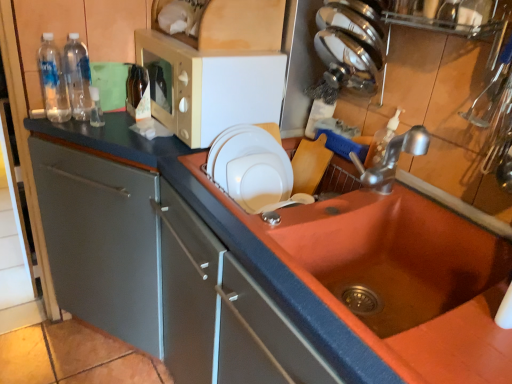
Question: Which direction should I rotate to face white glossy plate at upper center, which appears as the 1th appliance when ordered from the bottom, — up or down?

Choices:
 (A) up
 (B) down

Answer: (A)

Question: From a real-world perspective, is brown glass bottle at upper left, which is the third bottle from left to right, under clear plastic bottles at left, placed as the first bottle when sorted from left to right?

Choices:
 (A) no
 (B) yes

Answer: (B)

Question: Can you confirm if brown glass bottle at upper left, acting as the 1th bottle starting from the right, is thinner than clear plastic bottles at left, placed as the first bottle when sorted from left to right?

Choices:
 (A) yes
 (B) no

Answer: (A)

Question: Is clear plastic bottles at left, placed as the first bottle when sorted from left to right, a part of brown glass bottle at upper left, which is the third bottle from left to right?

Choices:
 (A) yes
 (B) no

Answer: (B)

Question: Is clear plastic bottles at left, placed as the first bottle when sorted from left to right, at the back of brown glass bottle at upper left, which is the third bottle from left to right?

Choices:
 (A) no
 (B) yes

Answer: (A)

Question: Can you confirm if brown glass bottle at upper left, which is the third bottle from left to right, is smaller than clear plastic bottles at left, the third bottle viewed from the right?

Choices:
 (A) no
 (B) yes

Answer: (B)

Question: Considering the relative positions of brown glass bottle at upper left, acting as the 1th bottle starting from the right, and clear plastic bottles at left, placed as the first bottle when sorted from left to right, in the image provided, is brown glass bottle at upper left, acting as the 1th bottle starting from the right, to the right of clear plastic bottles at left, placed as the first bottle when sorted from left to right, from the viewer's perspective?

Choices:
 (A) yes
 (B) no

Answer: (A)

Question: Is matte orange sink at center placed right next to clear plastic bottles at left, the third bottle viewed from the right?

Choices:
 (A) no
 (B) yes

Answer: (A)

Question: Is matte orange sink at center not within clear plastic bottles at left, the third bottle viewed from the right?

Choices:
 (A) yes
 (B) no

Answer: (A)

Question: Considering the relative sizes of matte orange sink at center and clear plastic bottles at left, placed as the first bottle when sorted from left to right, in the image provided, is matte orange sink at center wider than clear plastic bottles at left, placed as the first bottle when sorted from left to right,?

Choices:
 (A) no
 (B) yes

Answer: (B)

Question: Considering the relative sizes of matte orange sink at center and clear plastic bottles at left, the third bottle viewed from the right, in the image provided, is matte orange sink at center taller than clear plastic bottles at left, the third bottle viewed from the right,?

Choices:
 (A) no
 (B) yes

Answer: (A)

Question: From the image's perspective, is matte orange sink at center located beneath clear plastic bottles at left, the third bottle viewed from the right?

Choices:
 (A) yes
 (B) no

Answer: (A)

Question: Is matte orange sink at center behind clear plastic bottles at left, placed as the first bottle when sorted from left to right?

Choices:
 (A) no
 (B) yes

Answer: (A)

Question: Considering the relative sizes of white glossy plate at upper center, which appears as the 2th appliance when viewed from the top, and brown glass bottle at upper left, which is the third bottle from left to right, in the image provided, is white glossy plate at upper center, which appears as the 2th appliance when viewed from the top, shorter than brown glass bottle at upper left, which is the third bottle from left to right,?

Choices:
 (A) yes
 (B) no

Answer: (B)